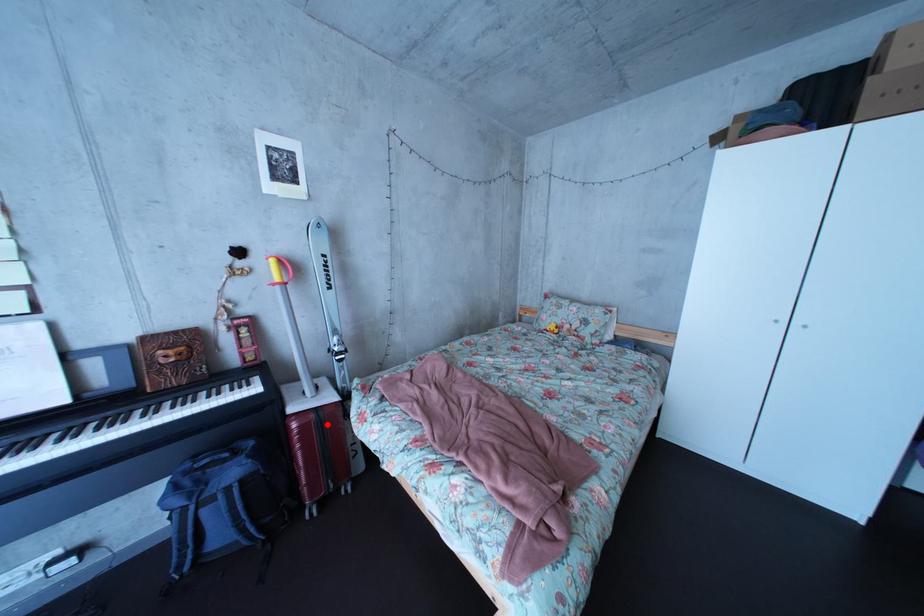
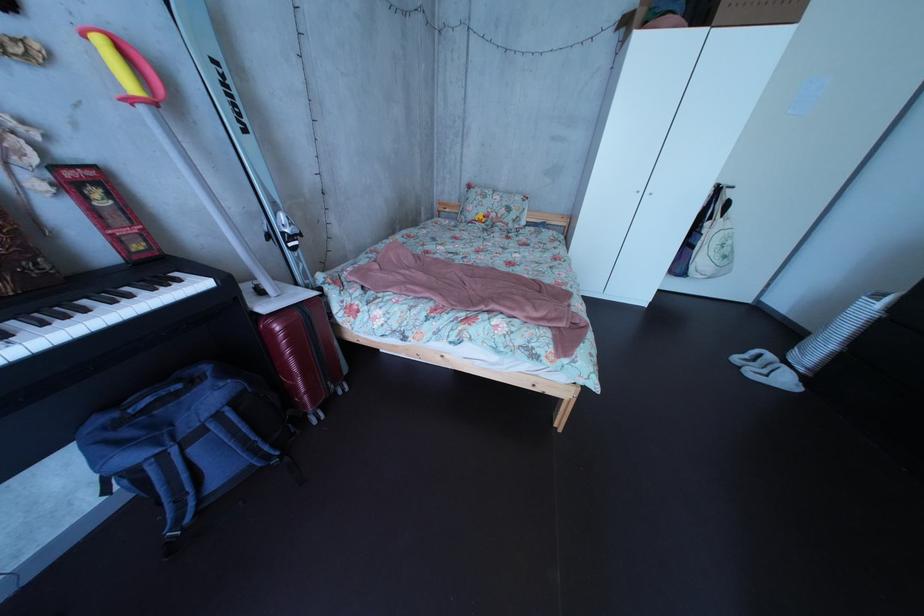
Where in the second image is the point corresponding to the highlighted location from the first image?

(311, 322)